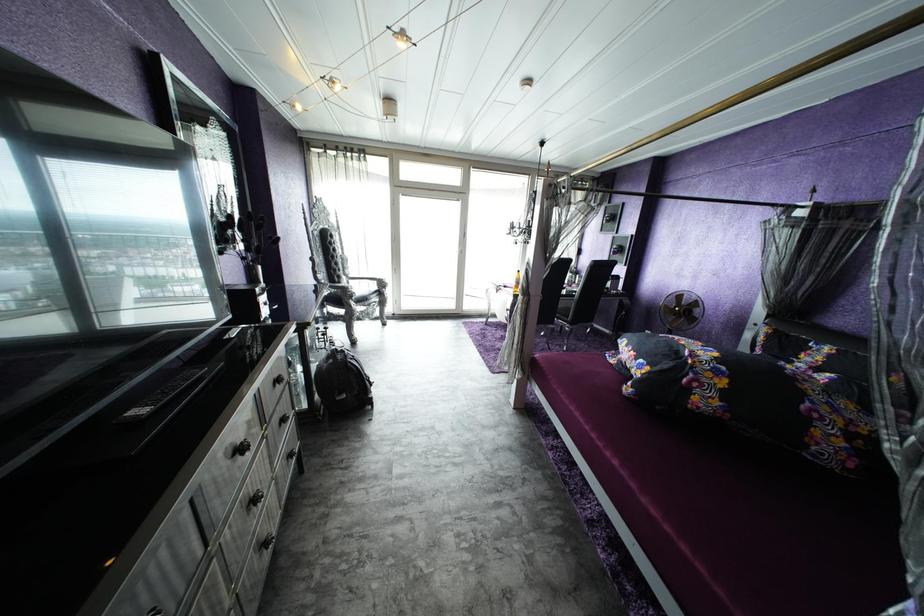
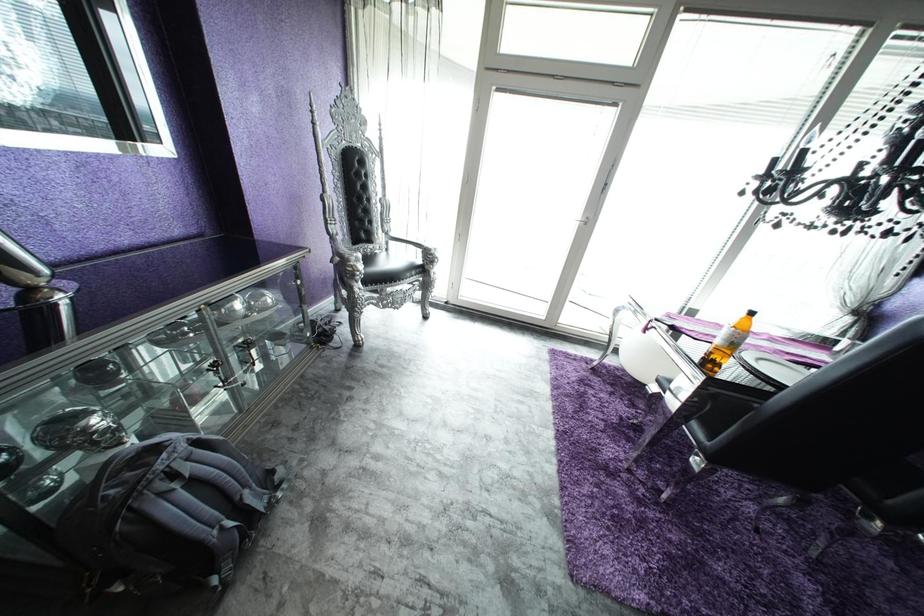
Question: Which direction would the cameraman need to move to produce the second image? Reply with the corresponding letter.

Choices:
 (A) Left
 (B) Right
 (C) Forward
 (D) Backward

Answer: (C)